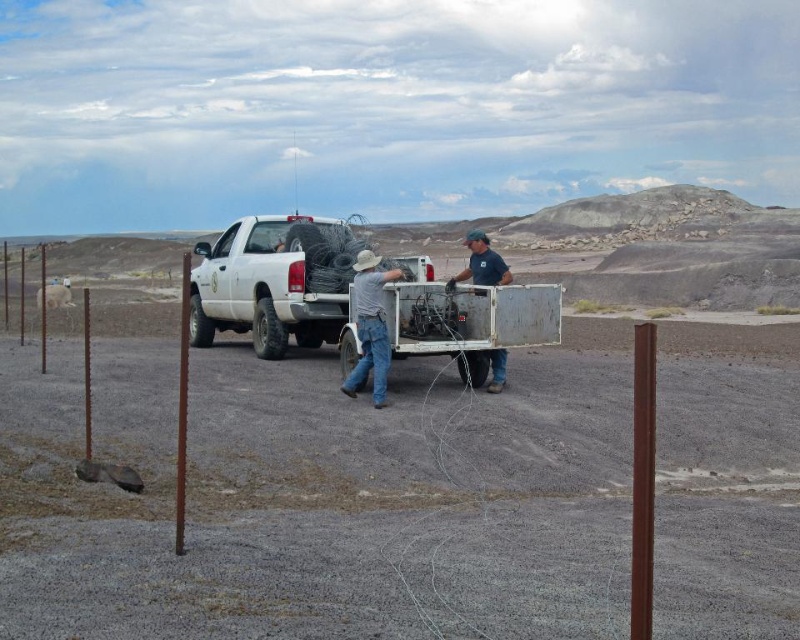
Question: Can you confirm if white matte truck at center is wider than denim jeans at center?

Choices:
 (A) yes
 (B) no

Answer: (A)

Question: Does white matte truck at center have a greater width compared to blue fabric shirt at center?

Choices:
 (A) no
 (B) yes

Answer: (B)

Question: Estimate the real-world distances between objects in this image. Which object is closer to the white matte truck at center?

Choices:
 (A) blue fabric shirt at center
 (B) denim jeans at center

Answer: (B)

Question: Which point is closer to the camera?

Choices:
 (A) (385, 356)
 (B) (197, 252)

Answer: (A)

Question: Which point is closer to the camera taking this photo?

Choices:
 (A) (482, 275)
 (B) (342, 305)
 (C) (384, 403)

Answer: (C)

Question: Is white matte truck at center bigger than blue fabric shirt at center?

Choices:
 (A) no
 (B) yes

Answer: (A)